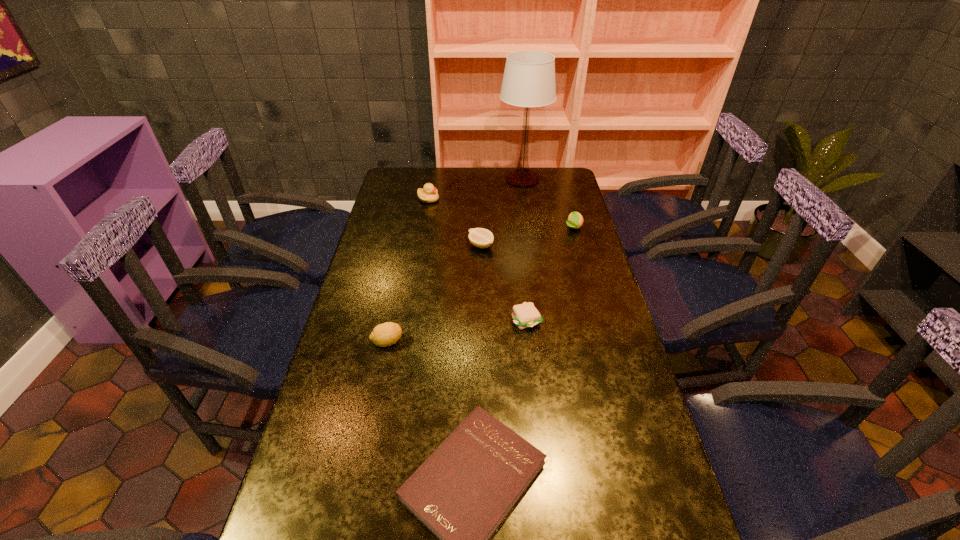
In order to click on vacant region located above the cylindrical shade of the table lamp in this screenshot , I will do `click(527, 213)`.

You are a GUI agent. You are given a task and a screenshot of the screen. Output one action in this format:
    pyautogui.click(x=<x>, y=<y>)
    Task: Click on the vacant space located 0.150m on the beak of the sixth nearest object
    
    Given the screenshot: What is the action you would take?
    pyautogui.click(x=474, y=199)

Where is `vacant region located 0.340m with leaves positioned above the rightmost object`? vacant region located 0.340m with leaves positioned above the rightmost object is located at coordinates (592, 296).

Where is `vacant region located at the stem end of the sixth farthest object`? Image resolution: width=960 pixels, height=540 pixels. vacant region located at the stem end of the sixth farthest object is located at coordinates (431, 342).

I want to click on vacant region located on the front of the shortest lemon, so coord(481,273).

This screenshot has height=540, width=960. I want to click on vacant space located 0.050m on the front of the third nearest object, so click(x=529, y=345).

Where is `table lamp that is at the far edge`? table lamp that is at the far edge is located at coordinates (529, 77).

The width and height of the screenshot is (960, 540). Identify the location of duckling located at the far edge. (429, 194).

You are a GUI agent. You are given a task and a screenshot of the screen. Output one action in this format:
    pyautogui.click(x=<x>, y=<y>)
    Task: Click on the duckling located at the left edge
    Image resolution: width=960 pixels, height=540 pixels.
    Given the screenshot: What is the action you would take?
    pyautogui.click(x=429, y=194)

The width and height of the screenshot is (960, 540). I want to click on lemon present at the left edge, so click(383, 335).